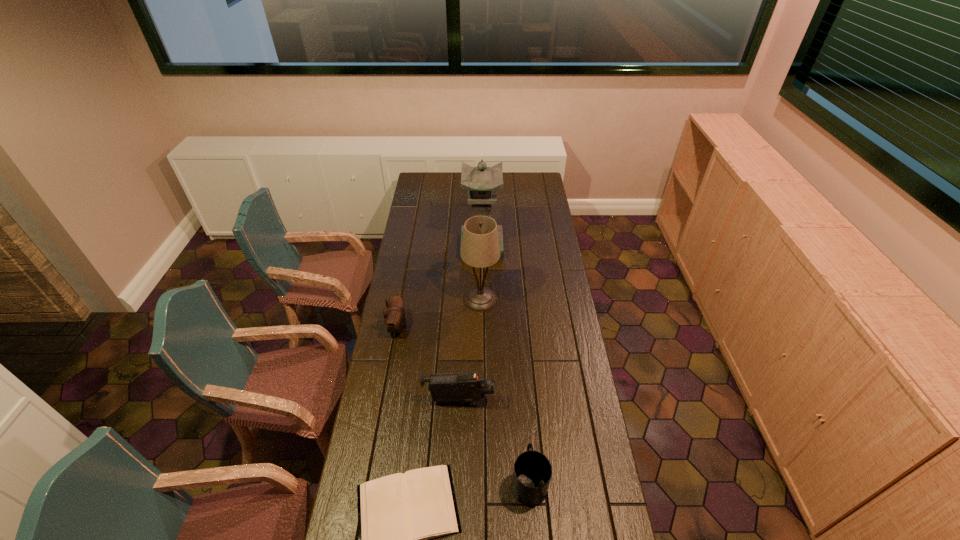
Find the location of a particular element. Image resolution: width=960 pixels, height=540 pixels. object that is the fourth closest to the hardback book is located at coordinates (480, 248).

Where is `the second closest object relative to the mug`? the second closest object relative to the mug is located at coordinates (466, 387).

What are the coordinates of `free space that satisfies the following two spatial constraints: 1. at the front opening of the sculpture; 2. on the front-facing side of the fifth shortest object` in the screenshot? It's located at (482, 299).

You are a GUI agent. You are given a task and a screenshot of the screen. Output one action in this format:
    pyautogui.click(x=<x>, y=<y>)
    Task: Click on the vacant space that satisfies the following two spatial constraints: 1. on the side of the mug with the handle; 2. on the front-facing side of the fourth shortest object
    Image resolution: width=960 pixels, height=540 pixels.
    Given the screenshot: What is the action you would take?
    pyautogui.click(x=522, y=401)

Locate an element on the screen. Image resolution: width=960 pixels, height=540 pixels. blank space that satisfies the following two spatial constraints: 1. at the front opening of the sculpture; 2. on the front-facing side of the fifth nearest object is located at coordinates (482, 299).

Locate an element on the screen. This screenshot has width=960, height=540. vacant region that satisfies the following two spatial constraints: 1. on the side of the mug with the handle; 2. on the front-facing side of the fifth nearest object is located at coordinates (x=515, y=299).

Find the location of a particular element. free space that satisfies the following two spatial constraints: 1. at the front opening of the sculpture; 2. on the front-facing side of the fifth nearest object is located at coordinates (482, 299).